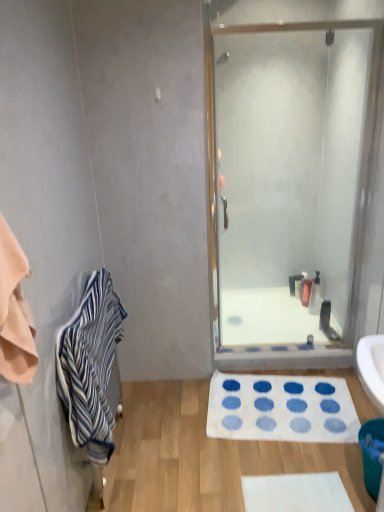
This screenshot has width=384, height=512. Find the location of `white textured bath mat at center`. white textured bath mat at center is located at coordinates (281, 409).

What do you see at coordinates (372, 454) in the screenshot? I see `teal plastic trash can at lower right` at bounding box center [372, 454].

What do you see at coordinates (305, 290) in the screenshot?
I see `translucent plastic soap dispenser at center` at bounding box center [305, 290].

The image size is (384, 512). In order to click on blue striped towel at left in this screenshot , I will do `click(90, 366)`.

Find the location of `clear glass shower door at center`. clear glass shower door at center is located at coordinates (287, 177).

What are the coordinates of `white textured bath mat at center` in the screenshot? It's located at coord(281,409).

Considering the relative positions of white glossy bath at center and teal plastic trash can at lower right in the image provided, is white glossy bath at center behind teal plastic trash can at lower right?

Yes, the depth of white glossy bath at center is greater than that of teal plastic trash can at lower right.

This screenshot has width=384, height=512. I want to click on trash bin/can on the right of the white glossy bath at center, so click(x=372, y=454).

How distant is white glossy bath at center from teal plastic trash can at lower right?

The distance of white glossy bath at center from teal plastic trash can at lower right is 34.84 inches.

From a real-world perspective, relative to teal plastic trash can at lower right, is white glossy bath at center vertically above or below?

white glossy bath at center is situated lower than teal plastic trash can at lower right in the real world.

From a real-world perspective, is translucent plastic soap dispenser at center over white glossy bath at center?

Yes.

Does translucent plastic soap dispenser at center have a larger size compared to white glossy bath at center?

No, translucent plastic soap dispenser at center is not bigger than white glossy bath at center.

Considering the positions of point (300, 294) and point (242, 298), is point (300, 294) closer or farther from the camera than point (242, 298)?

Clearly, point (300, 294) is closer to the camera than point (242, 298).

Is translucent plastic soap dispenser at center further to camera compared to white glossy bath at center?

Yes, translucent plastic soap dispenser at center is further from the camera.

Considering the sizes of objects teal plastic trash can at lower right and white glossy bath at center in the image provided, who is shorter, teal plastic trash can at lower right or white glossy bath at center?

With less height is white glossy bath at center.

Could you tell me if teal plastic trash can at lower right is facing white glossy bath at center?

No, teal plastic trash can at lower right is not aimed at white glossy bath at center.

Considering the positions of objects teal plastic trash can at lower right and white glossy bath at center in the image provided, who is more to the right, teal plastic trash can at lower right or white glossy bath at center?

Positioned to the right is teal plastic trash can at lower right.

Is white glossy bath at center wider or thinner than blue striped towel at left?

Considering their sizes, white glossy bath at center looks broader than blue striped towel at left.

Is white glossy bath at center oriented away from blue striped towel at left?

No, white glossy bath at center is not facing the opposite direction of blue striped towel at left.

From a real-world perspective, is white glossy bath at center physically located above or below blue striped towel at left?

From a real-world perspective, white glossy bath at center is physically below blue striped towel at left.

Measure the distance from white glossy bath at center to blue striped towel at left.

The distance of white glossy bath at center from blue striped towel at left is 39.09 inches.

Identify the location of toiletry beneath the blue striped towel at left (from a real-world perspective). The height and width of the screenshot is (512, 384). (305, 290).

Looking at this image, which object is thinner, translucent plastic soap dispenser at center or blue striped towel at left?

translucent plastic soap dispenser at center.

Which object is closer to the camera taking this photo, translucent plastic soap dispenser at center or blue striped towel at left?

blue striped towel at left is more forward.

Is translucent plastic soap dispenser at center facing towards blue striped towel at left?

No, translucent plastic soap dispenser at center is not facing towards blue striped towel at left.

Can you confirm if white textured bath mat at center is smaller than teal plastic trash can at lower right?

Incorrect, white textured bath mat at center is not smaller in size than teal plastic trash can at lower right.

Who is taller, white textured bath mat at center or teal plastic trash can at lower right?

Standing taller between the two is teal plastic trash can at lower right.

From the image's perspective, is white textured bath mat at center beneath teal plastic trash can at lower right?

No, from the image's perspective, white textured bath mat at center is not beneath teal plastic trash can at lower right.

Is white textured bath mat at center turned away from teal plastic trash can at lower right?

white textured bath mat at center does not have its back to teal plastic trash can at lower right.

From the image's perspective, which one is positioned higher, white glossy bath at center or translucent plastic soap dispenser at center?

translucent plastic soap dispenser at center, from the image's perspective.

Is white glossy bath at center facing towards translucent plastic soap dispenser at center?

No, white glossy bath at center is not facing towards translucent plastic soap dispenser at center.

Is white glossy bath at center completely or partially outside of translucent plastic soap dispenser at center?

Absolutely, white glossy bath at center is external to translucent plastic soap dispenser at center.

Which of these two, white glossy bath at center or translucent plastic soap dispenser at center, is wider?

Wider between the two is white glossy bath at center.

Image resolution: width=384 pixels, height=512 pixels. Find the location of `trash bin/can located on the right of white glossy bath at center`. trash bin/can located on the right of white glossy bath at center is located at coordinates (372, 454).

Locate an element on the screen. This screenshot has height=512, width=384. bath on the left of translucent plastic soap dispenser at center is located at coordinates (266, 318).

Estimate the real-world distances between objects in this image. Which object is closer to translucent plastic soap dispenser at center, teal plastic trash can at lower right or white glossy bath at center?

The object closer to translucent plastic soap dispenser at center is white glossy bath at center.

Which object lies further to the anchor point white glossy bath at center, white fabric mat at lower center or clear glass shower door at center?

white fabric mat at lower center is positioned further to the anchor white glossy bath at center.

Based on their spatial positions, is translucent plastic soap dispenser at center or blue striped towel at left further from white glossy bath at center?

Among the two, blue striped towel at left is located further to white glossy bath at center.

Which object lies nearer to the anchor point clear glass shower door at center, white textured bath mat at center or white glossy bath at center?

white glossy bath at center is closer to clear glass shower door at center.

Looking at this image, considering their positions, is white glossy bath at center positioned closer to white fabric mat at lower center than clear glass shower door at center?

white glossy bath at center lies closer to white fabric mat at lower center than the other object.

Which object lies nearer to the anchor point teal plastic trash can at lower right, white glossy bath at center or blue striped towel at left?

white glossy bath at center is positioned closer to the anchor teal plastic trash can at lower right.

Estimate the real-world distances between objects in this image. Which object is closer to white fabric mat at lower center, clear glass shower door at center or translucent plastic soap dispenser at center?

Based on the image, translucent plastic soap dispenser at center appears to be nearer to white fabric mat at lower center.

Which object lies further to the anchor point translucent plastic soap dispenser at center, blue striped towel at left or white textured bath mat at center?

blue striped towel at left is positioned further to the anchor translucent plastic soap dispenser at center.

You are a GUI agent. You are given a task and a screenshot of the screen. Output one action in this format:
    pyautogui.click(x=<x>, y=<y>)
    Task: Click on the plain between blue striped towel at left and teal plastic trash can at lower right
    The image size is (384, 512).
    Given the screenshot: What is the action you would take?
    pyautogui.click(x=204, y=455)

Where is `bath mat between blue striped towel at left and translucent plastic soap dispenser at center along the z-axis`? The height and width of the screenshot is (512, 384). bath mat between blue striped towel at left and translucent plastic soap dispenser at center along the z-axis is located at coordinates (281, 409).

I want to click on trash bin/can between clear glass shower door at center and white fabric mat at lower center in the vertical direction, so click(372, 454).

Where is `bath between white textured bath mat at center and translucent plastic soap dispenser at center from front to back`? The width and height of the screenshot is (384, 512). bath between white textured bath mat at center and translucent plastic soap dispenser at center from front to back is located at coordinates (266, 318).